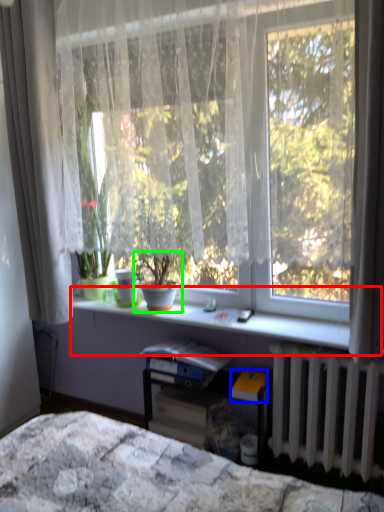
Question: Which object is the closest to the window sill (highlighted by a red box)? Choose among these: paperback book (highlighted by a blue box) or houseplant (highlighted by a green box).

Choices:
 (A) paperback book
 (B) houseplant

Answer: (B)